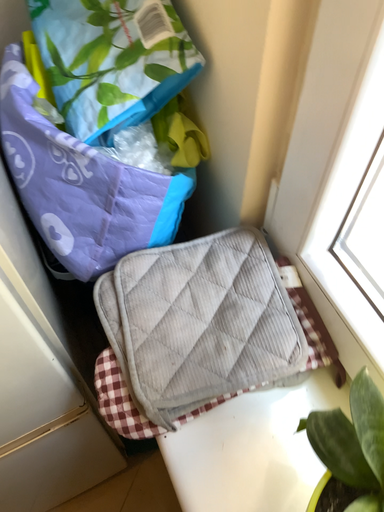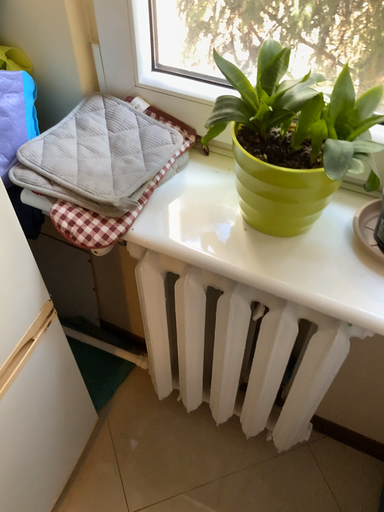
Question: Which way did the camera rotate in the video?

Choices:
 (A) rotated upward
 (B) rotated downward

Answer: (A)